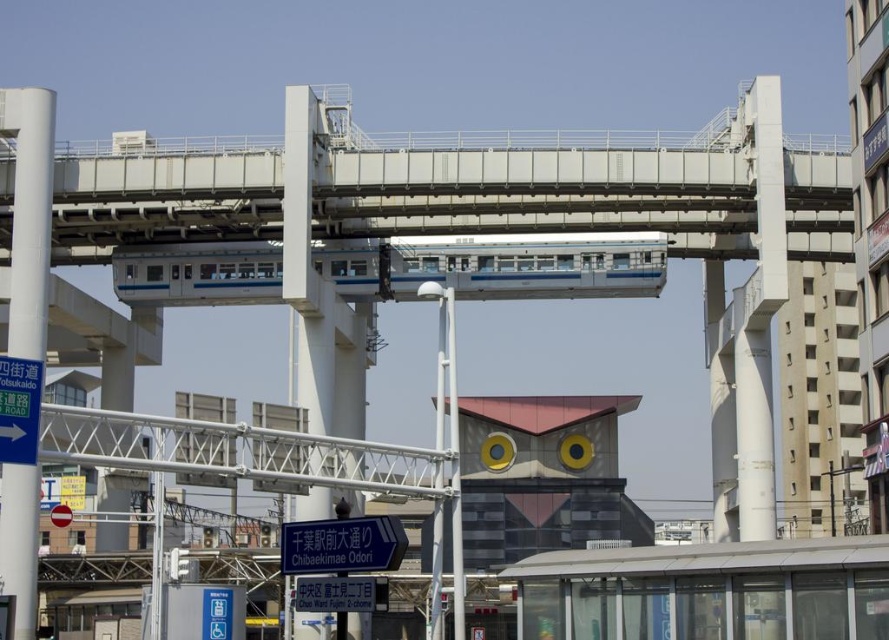
Question: Which point appears farthest from the camera in this image?

Choices:
 (A) (323, 536)
 (B) (721, 188)
 (C) (13, 561)
 (D) (319, 589)

Answer: (B)

Question: Which object is positioned closest to the white glossy pole at left?

Choices:
 (A) blue plastic sign at center
 (B) blue plastic street sign at center
 (C) white metallic overpass at center

Answer: (C)

Question: Which point is farther to the camera?

Choices:
 (A) (315, 577)
 (B) (30, 308)

Answer: (B)

Question: Can you confirm if white glossy pole at left is smaller than blue plastic sign at center?

Choices:
 (A) no
 (B) yes

Answer: (A)

Question: Can you confirm if white metallic overpass at center is positioned below blue plastic sign at center?

Choices:
 (A) no
 (B) yes

Answer: (A)

Question: Is white metallic overpass at center positioned at the back of white glossy pole at left?

Choices:
 (A) yes
 (B) no

Answer: (A)